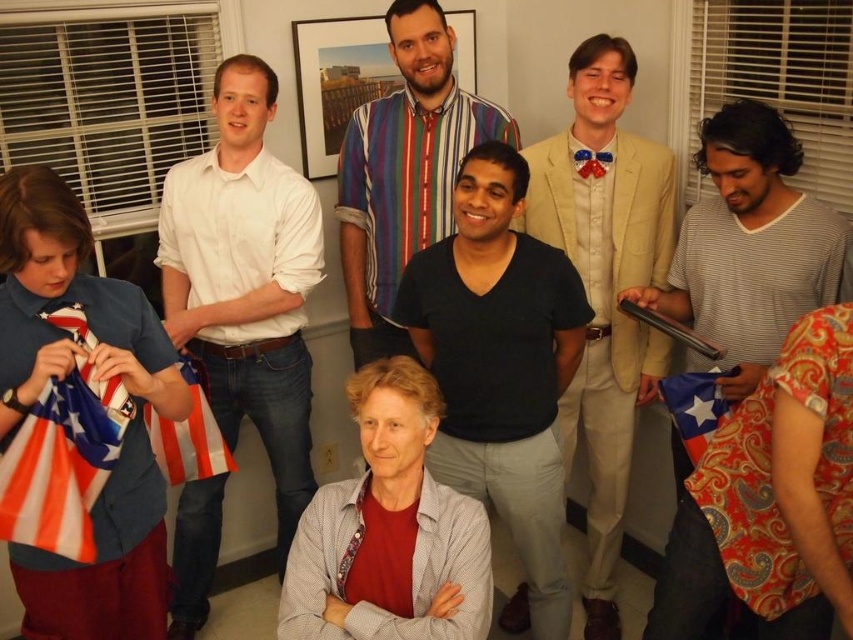
Question: Which point appears farthest from the camera in this image?

Choices:
 (A) (248, 80)
 (B) (778, 300)

Answer: (A)

Question: Can you confirm if gray textured sweater at center is wider than american flag at lower left?

Choices:
 (A) yes
 (B) no

Answer: (A)

Question: Does black cotton shirt at center have a smaller size compared to dark blue shirt at center?

Choices:
 (A) yes
 (B) no

Answer: (B)

Question: Which of the following is the farthest from the observer?

Choices:
 (A) (581, 403)
 (B) (682, 404)

Answer: (A)

Question: Does blue cotton shirt at left appear over dark blue shirt at center?

Choices:
 (A) yes
 (B) no

Answer: (B)

Question: Which point is farther to the camera?

Choices:
 (A) white cotton shirt at left
 (B) black cotton shirt at center

Answer: (A)